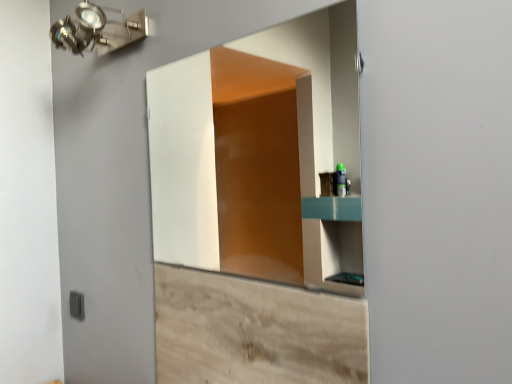
Question: From a real-world perspective, relative to matte glass mirror at center, is gray plastic light switch at lower left vertically above or below?

Choices:
 (A) above
 (B) below

Answer: (B)

Question: Do you think gray plastic light switch at lower left is within matte glass mirror at center, or outside of it?

Choices:
 (A) inside
 (B) outside

Answer: (B)

Question: Which object is the farthest from the matte glass mirror at center?

Choices:
 (A) metallic wall-mounted light fixture at upper left
 (B) wooden cabinet at lower center
 (C) gray plastic light switch at lower left

Answer: (C)

Question: Which object is positioned farthest from the metallic wall-mounted light fixture at upper left?

Choices:
 (A) gray plastic light switch at lower left
 (B) matte glass mirror at center
 (C) wooden cabinet at lower center

Answer: (B)